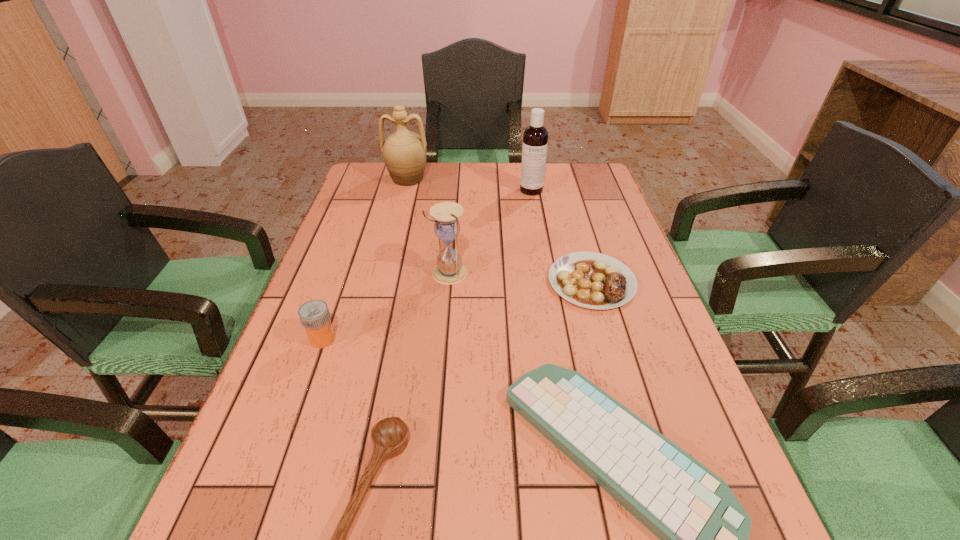
This screenshot has height=540, width=960. Identify the location of free location that satisfies the following two spatial constraints: 1. on the front side of the steak; 2. on the label side of the medicine. (609, 339).

The image size is (960, 540). What are the coordinates of `free space that satisfies the following two spatial constraints: 1. on the front side of the steak; 2. on the label side of the medicine` in the screenshot? It's located at (609, 339).

You are a GUI agent. You are given a task and a screenshot of the screen. Output one action in this format:
    pyautogui.click(x=<x>, y=<y>)
    Task: Click on the free space that satisfies the following two spatial constraints: 1. on the label side of the steak; 2. on the left side of the dishwasher detergent
    
    Given the screenshot: What is the action you would take?
    pyautogui.click(x=547, y=282)